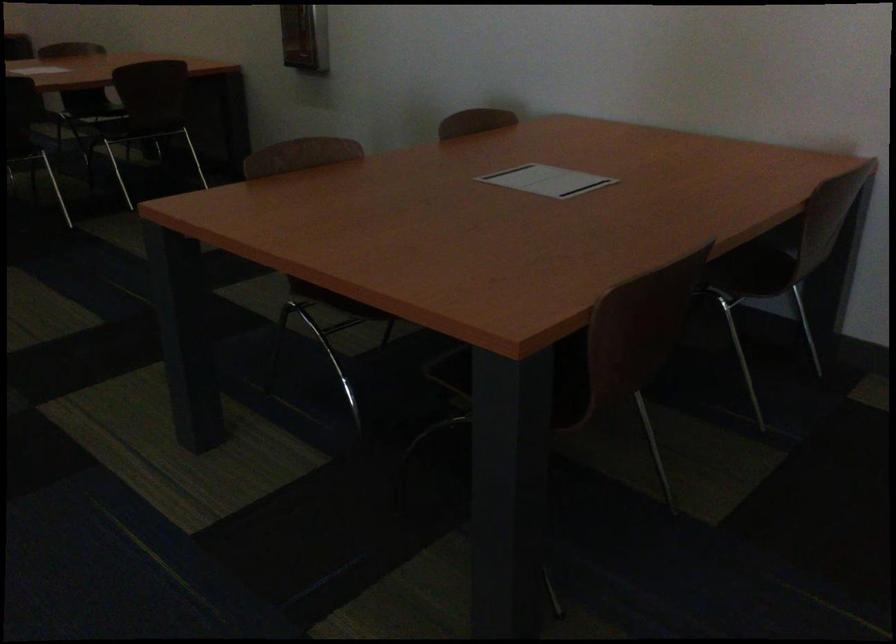
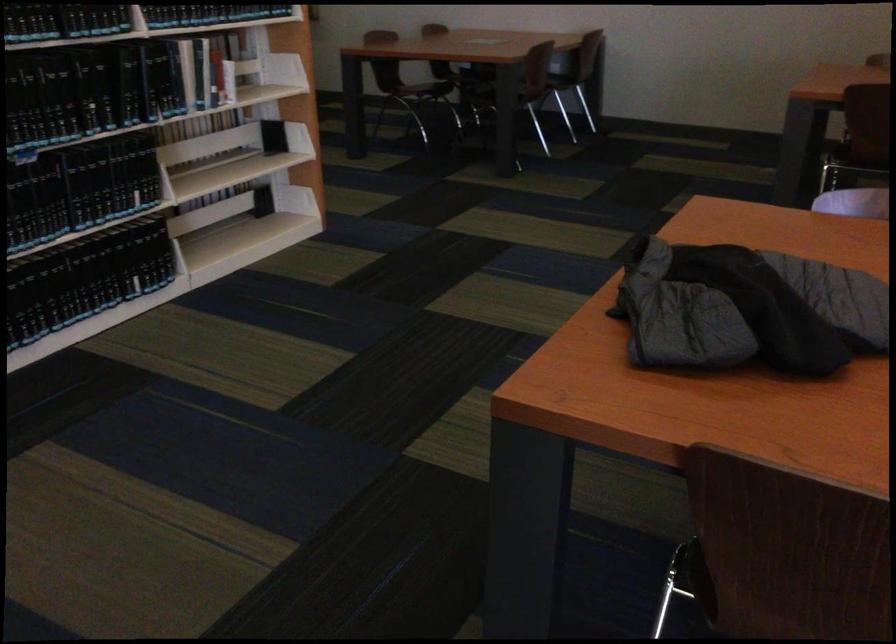
From the picture: Which direction would the cameraman need to move to produce the second image?

The cameraman moved toward left, backward.